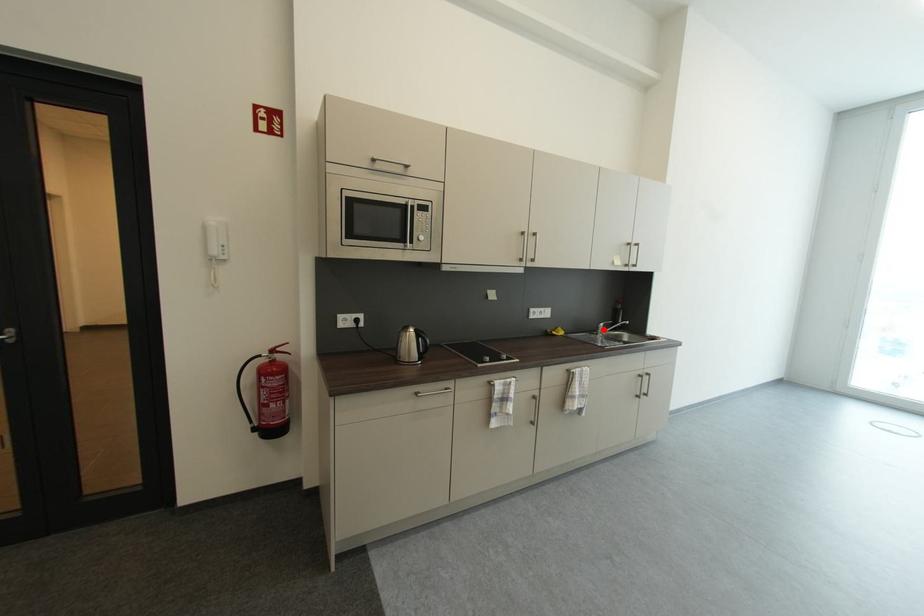
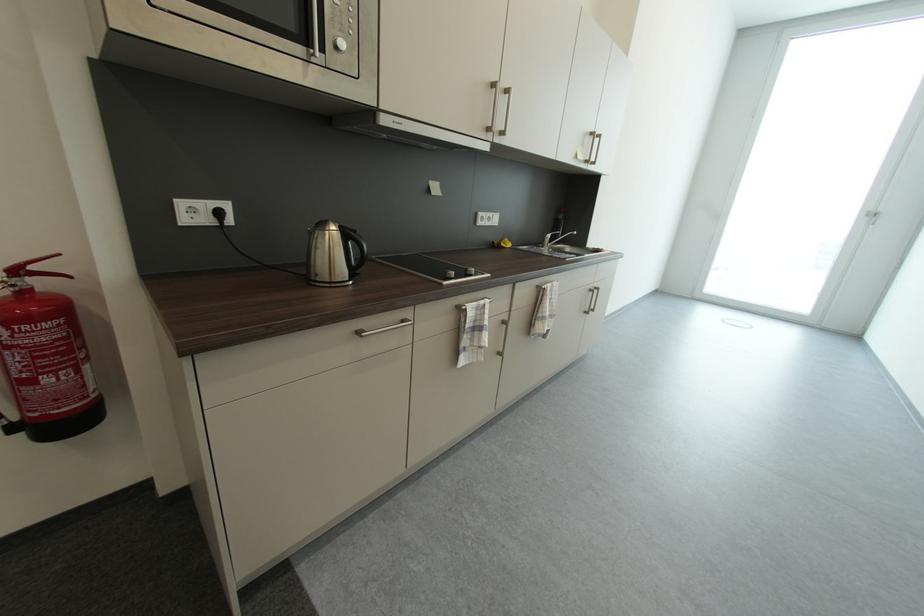
In the second image, find the point that corresponds to the highlighted location in the first image.

(550, 241)